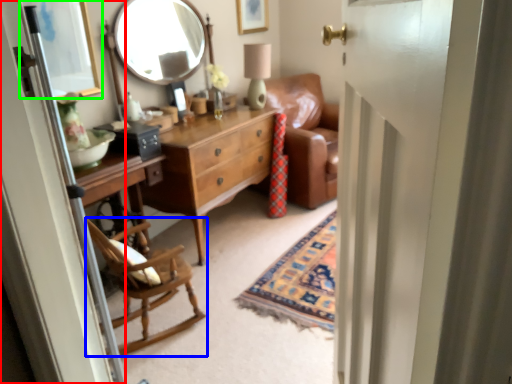
Question: Estimate the real-world distances between objects in this image. Which object is closer to screen door (highlighted by a red box), chair (highlighted by a blue box) or picture frame (highlighted by a green box)?

Choices:
 (A) chair
 (B) picture frame

Answer: (A)